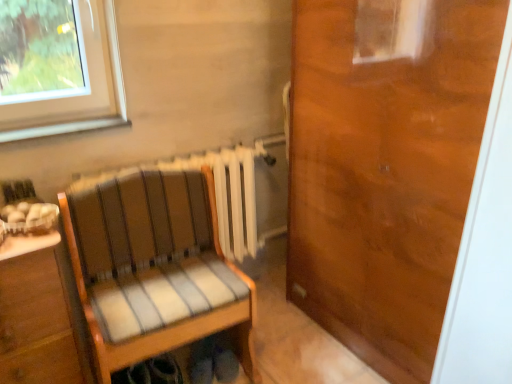
Locate an element on the screen. vacant space to the right of striped fabric chair at center is located at coordinates (292, 347).